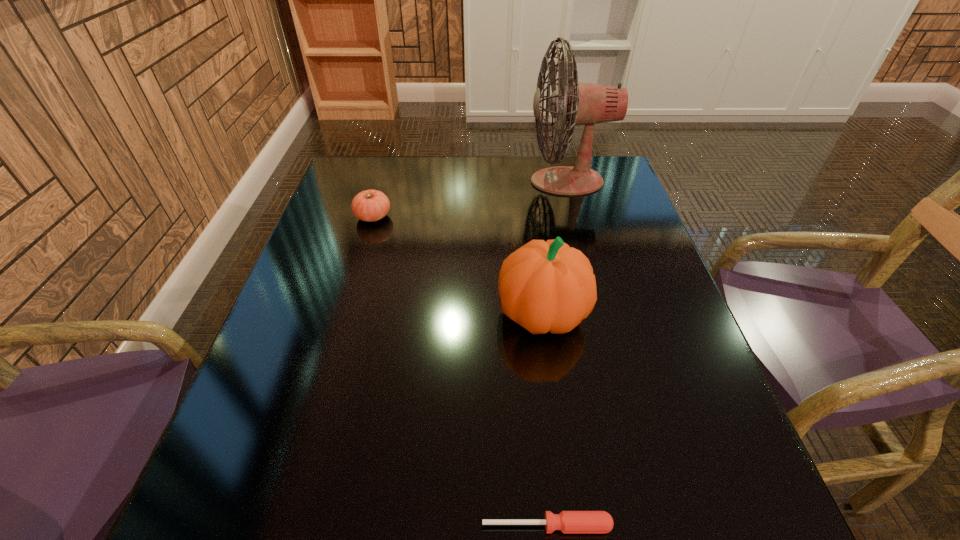
You are a GUI agent. You are given a task and a screenshot of the screen. Output one action in this format:
    pyautogui.click(x=<x>, y=<y>)
    Task: Click on the free space located on the back of the second tallest object
    
    Given the screenshot: What is the action you would take?
    pyautogui.click(x=529, y=210)

Where is `free space located 0.340m on the right of the tomato`? The height and width of the screenshot is (540, 960). free space located 0.340m on the right of the tomato is located at coordinates (517, 217).

At what (x,y) coordinates should I click in order to perform the action: click on free space located on the left of the screwdriver. Please return your answer as a coordinate pair (x, y). The image size is (960, 540). Looking at the image, I should click on (325, 525).

Find the location of a particular element. This screenshot has height=540, width=960. object that is at the far edge is located at coordinates (578, 103).

What are the coordinates of `object that is positioned at the near edge` in the screenshot? It's located at (567, 521).

At what (x,y) coordinates should I click in order to perform the action: click on object positioned at the left edge. Please return your answer as a coordinate pair (x, y). Looking at the image, I should click on (370, 205).

Identify the location of object positioned at the right edge. This screenshot has height=540, width=960. (578, 103).

Find the location of a particular element. object present at the far right corner is located at coordinates (578, 103).

In the image, there is a desktop. Identify the location of vacant space at the far edge. (492, 161).

In the image, there is a desktop. At what (x,y) coordinates should I click in order to perform the action: click on free space at the near edge. Please return your answer as a coordinate pair (x, y). The width and height of the screenshot is (960, 540). Looking at the image, I should click on (607, 488).